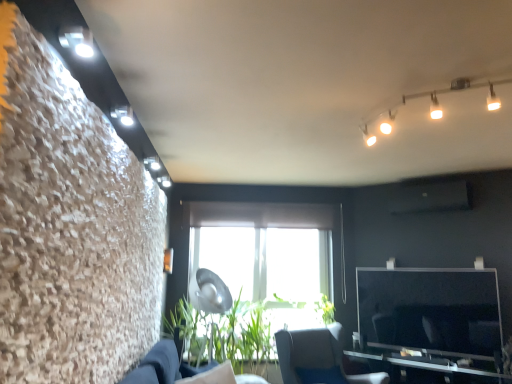
Question: From the image's perspective, would you say white glossy track lights at upper right is shown under dark blue fabric couch at lower center?

Choices:
 (A) yes
 (B) no

Answer: (B)

Question: Considering the relative positions of white glossy track lights at upper right and dark blue fabric couch at lower center in the image provided, is white glossy track lights at upper right behind dark blue fabric couch at lower center?

Choices:
 (A) yes
 (B) no

Answer: (B)

Question: Can you confirm if white glossy track lights at upper right is taller than dark blue fabric couch at lower center?

Choices:
 (A) yes
 (B) no

Answer: (B)

Question: From a real-world perspective, is white glossy track lights at upper right located beneath dark blue fabric couch at lower center?

Choices:
 (A) yes
 (B) no

Answer: (B)

Question: Is white glossy track lights at upper right not close to dark blue fabric couch at lower center?

Choices:
 (A) yes
 (B) no

Answer: (A)

Question: Based on their positions, is green leafy plant at center located to the left or right of metallic silver table at lower right?

Choices:
 (A) right
 (B) left

Answer: (B)

Question: Considering their positions, is green leafy plant at center located in front of or behind metallic silver table at lower right?

Choices:
 (A) behind
 (B) front

Answer: (A)

Question: Considering the positions of green leafy plant at center and metallic silver table at lower right in the image, is green leafy plant at center taller or shorter than metallic silver table at lower right?

Choices:
 (A) short
 (B) tall

Answer: (B)

Question: Is green leafy plant at center bigger or smaller than metallic silver table at lower right?

Choices:
 (A) small
 (B) big

Answer: (B)

Question: From a real-world perspective, relative to white glossy track lights at upper right, is green leafy plant at center vertically above or below?

Choices:
 (A) below
 (B) above

Answer: (A)

Question: From the image's perspective, relative to white glossy track lights at upper right, is green leafy plant at center above or below?

Choices:
 (A) above
 (B) below

Answer: (B)

Question: Is point (230, 344) closer or farther from the camera than point (394, 107)?

Choices:
 (A) farther
 (B) closer

Answer: (A)

Question: Is green leafy plant at center to the left or to the right of white glossy track lights at upper right in the image?

Choices:
 (A) left
 (B) right

Answer: (A)

Question: From the image's perspective, is metallic silver table at lower right above or below green leafy plant at center?

Choices:
 (A) above
 (B) below

Answer: (B)

Question: Does point (479, 380) appear closer or farther from the camera than point (261, 329)?

Choices:
 (A) closer
 (B) farther

Answer: (A)